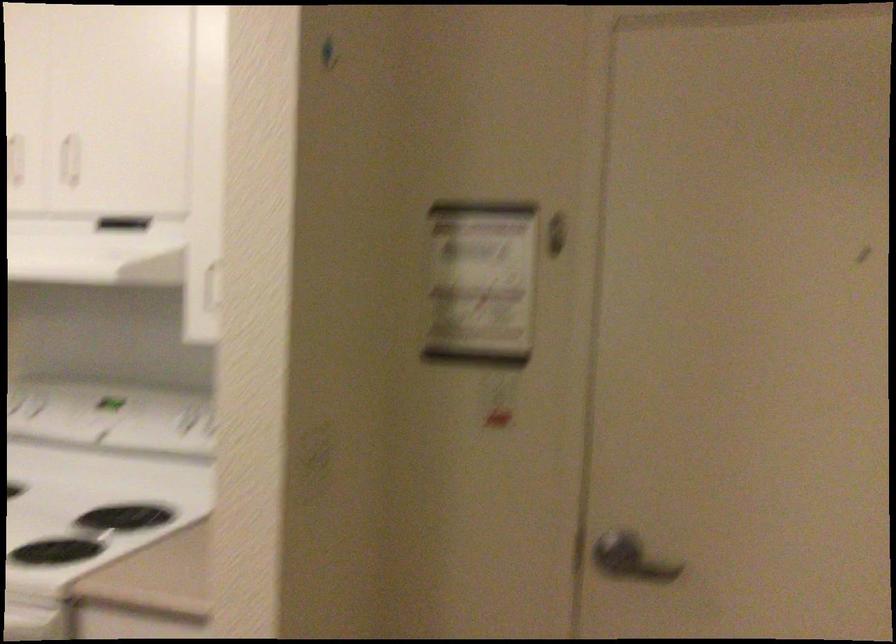
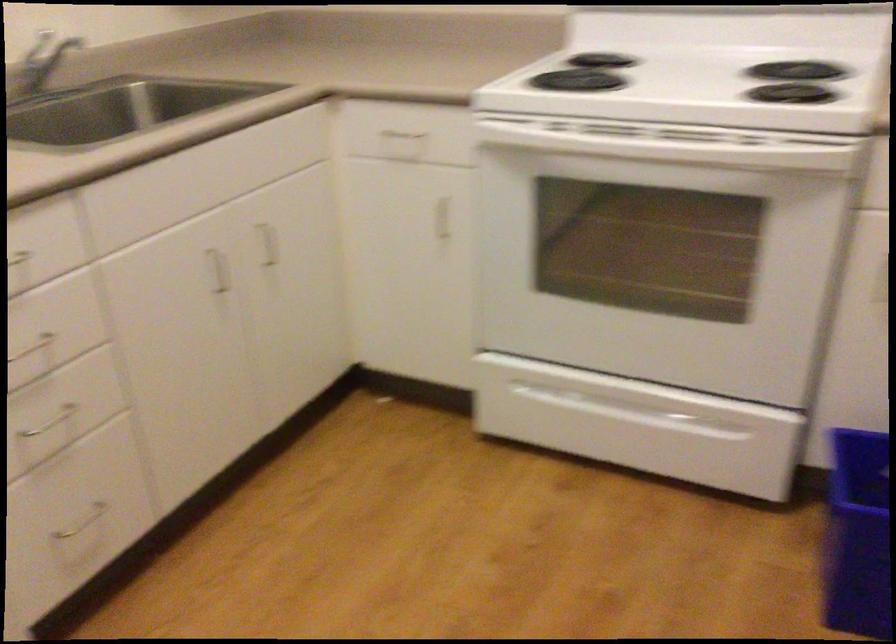
Question: In a continuous first-person perspective shot, in which direction is the camera moving?

Choices:
 (A) Left
 (B) Right
 (C) Forward
 (D) Backward

Answer: (A)